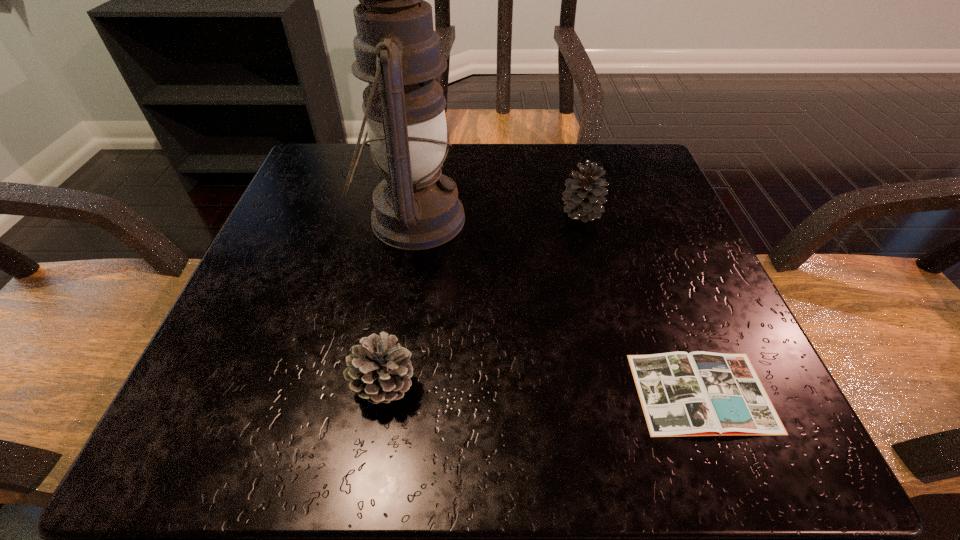
You are a GUI agent. You are given a task and a screenshot of the screen. Output one action in this format:
    pyautogui.click(x=<x>, y=<y>)
    Task: Click on the tallest object
    
    Given the screenshot: What is the action you would take?
    pyautogui.click(x=397, y=52)

You are a GUI agent. You are given a task and a screenshot of the screen. Output one action in this format:
    pyautogui.click(x=<x>, y=<y>)
    Task: Click on the taller pinecone
    
    Given the screenshot: What is the action you would take?
    pyautogui.click(x=584, y=196)

Locate an element on the screen. Image resolution: width=960 pixels, height=540 pixels. the second tallest object is located at coordinates (584, 196).

Where is `the nearer pinecone`? This screenshot has height=540, width=960. the nearer pinecone is located at coordinates (380, 372).

Find the location of a particular element. The width and height of the screenshot is (960, 540). the second shortest object is located at coordinates (380, 372).

Find the location of `book`. book is located at coordinates (699, 393).

Where is `free space located on the front of the oil lamp`? The height and width of the screenshot is (540, 960). free space located on the front of the oil lamp is located at coordinates [386, 383].

You are a GUI agent. You are given a task and a screenshot of the screen. Output one action in this format:
    pyautogui.click(x=<x>, y=<y>)
    Task: Click on the free location located 0.150m on the back of the right pinecone
    This screenshot has height=540, width=960.
    Given the screenshot: What is the action you would take?
    pyautogui.click(x=567, y=158)

This screenshot has width=960, height=540. I want to click on free space located 0.130m on the left of the left pinecone, so click(251, 386).

You are a GUI agent. You are given a task and a screenshot of the screen. Output one action in this format:
    pyautogui.click(x=<x>, y=<y>)
    Task: Click on the free space located on the left of the shortest object
    
    Given the screenshot: What is the action you would take?
    pyautogui.click(x=364, y=393)